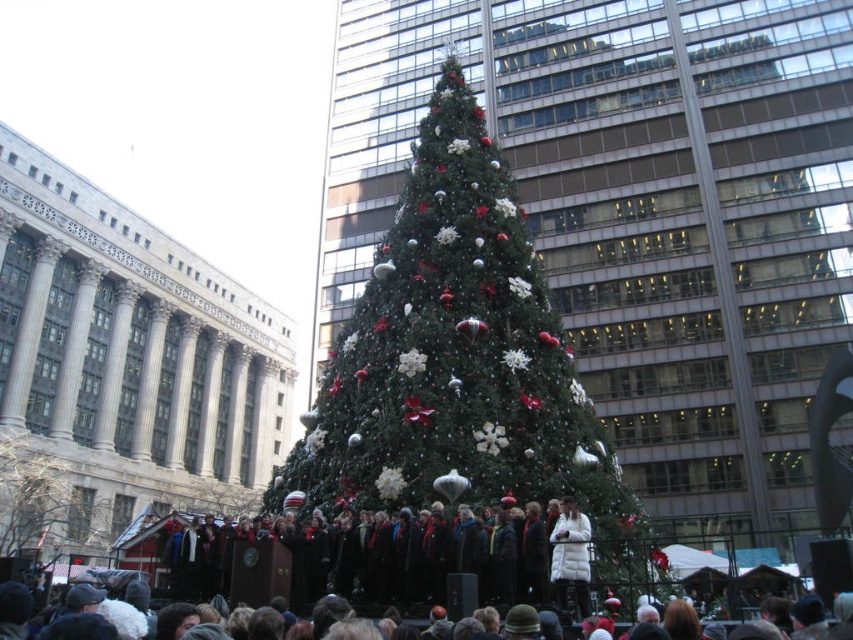
Question: Does green textured christmas tree at center come behind green matte christmas tree at center?

Choices:
 (A) yes
 (B) no

Answer: (B)

Question: Which of the following is the closest to the observer?

Choices:
 (A) (572, 570)
 (B) (27, 497)
 (C) (405, 497)

Answer: (A)

Question: Which object is positioned closest to the green textured christmas tree at center?

Choices:
 (A) green matte christmas tree at center
 (B) dark brown hair at lower center
 (C) white puffy coat at center

Answer: (C)

Question: Which of the following is the closest to the observer?

Choices:
 (A) (83, 486)
 (B) (83, 600)

Answer: (B)

Question: Does green textured christmas tree at center appear on the left side of dark brown hair at lower center?

Choices:
 (A) yes
 (B) no

Answer: (B)

Question: Does green matte christmas tree at center appear over white puffy coat at center?

Choices:
 (A) no
 (B) yes

Answer: (A)